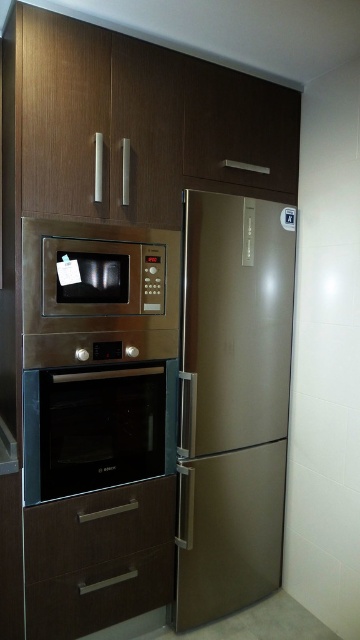
Question: Is stainless steel oven at center closer to camera compared to brown wood drawer at lower center?

Choices:
 (A) no
 (B) yes

Answer: (B)

Question: Which of the following is the farthest from the observer?

Choices:
 (A) (239, 230)
 (B) (25, 392)
 (C) (171, 513)
 (D) (64, 618)

Answer: (A)

Question: In this image, where is gold metallic refrigerator at center located relative to stainless steel oven at center?

Choices:
 (A) left
 (B) right

Answer: (B)

Question: Estimate the real-world distances between objects in this image. Which object is farther from the gold metallic refrigerator at center?

Choices:
 (A) brown wood drawer at lower center
 (B) stainless steel oven at center
 (C) brown matte drawer at lower center

Answer: (C)

Question: Which of the following is the closest to the observer?

Choices:
 (A) (62, 616)
 (B) (78, 547)
 (C) (32, 451)
 (D) (235, 300)

Answer: (C)

Question: Does gold metallic refrigerator at center have a larger size compared to brown wood drawer at lower center?

Choices:
 (A) no
 (B) yes

Answer: (B)